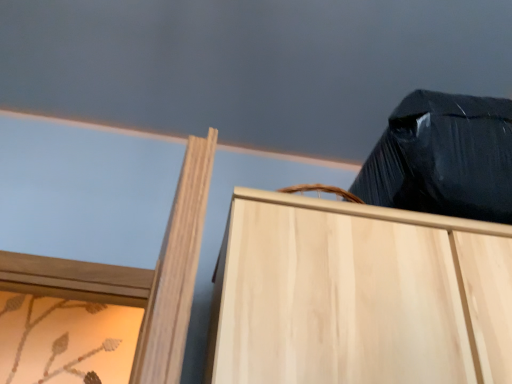
Measure the distance between point [192,36] and camera.

They are 3.96 feet apart.

What do you see at coordinates (250, 65) in the screenshot?
I see `black plastic bag at upper right` at bounding box center [250, 65].

This screenshot has height=384, width=512. I want to click on black plastic bag at upper right, so click(250, 65).

I want to click on black plastic bag at upper right, so click(x=250, y=65).